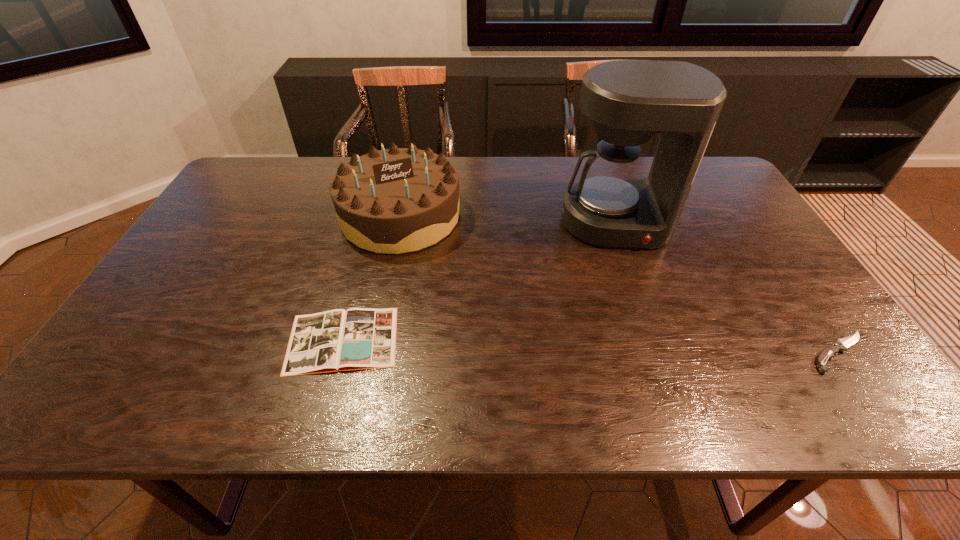
Find the location of a particular element. The image size is (960, 540). free point at the left edge is located at coordinates (245, 208).

At what (x,y) coordinates should I click in order to perform the action: click on free space at the right edge of the desktop. Please return your answer as a coordinate pair (x, y). Looking at the image, I should click on (757, 301).

Find the location of `free space between the book and the pocketknife`. free space between the book and the pocketknife is located at coordinates (591, 346).

At what (x,y) coordinates should I click in order to perform the action: click on free point between the rightmost object and the birthday cake. Please return your answer as a coordinate pair (x, y). Looking at the image, I should click on (620, 284).

Where is `vacant region between the book and the coffee maker`? This screenshot has height=540, width=960. vacant region between the book and the coffee maker is located at coordinates (479, 282).

Identify the location of vacant area that lies between the pocketknife and the third shortest object. (620, 284).

What are the coordinates of `vacant region between the birthday cake and the rightmost object` in the screenshot? It's located at (620, 284).

Where is `vacant space that's between the birthday cake and the tallest object`? vacant space that's between the birthday cake and the tallest object is located at coordinates (508, 220).

You are a GUI agent. You are given a task and a screenshot of the screen. Output one action in this format:
    pyautogui.click(x=<x>, y=<y>)
    Task: Click on the vacant point located between the birthday cake and the rightmost object
    
    Given the screenshot: What is the action you would take?
    pyautogui.click(x=620, y=284)

Locate an element on the screen. Image resolution: width=960 pixels, height=540 pixels. vacant space in between the third shortest object and the book is located at coordinates (372, 278).